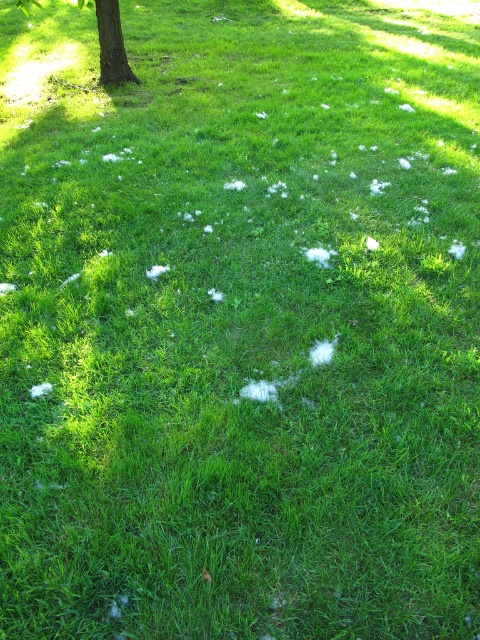
You are a gardener examining the brown textured tree at upper left and the brown rough bark at upper left in the park. Which object is narrower?

The brown textured tree at upper left is narrower than the brown rough bark at upper left.

You are standing in the park and see the brown textured tree at upper left and the brown rough bark at upper left. Which object is closer to you?

The brown textured tree at upper left is closer to you than the brown rough bark at upper left.